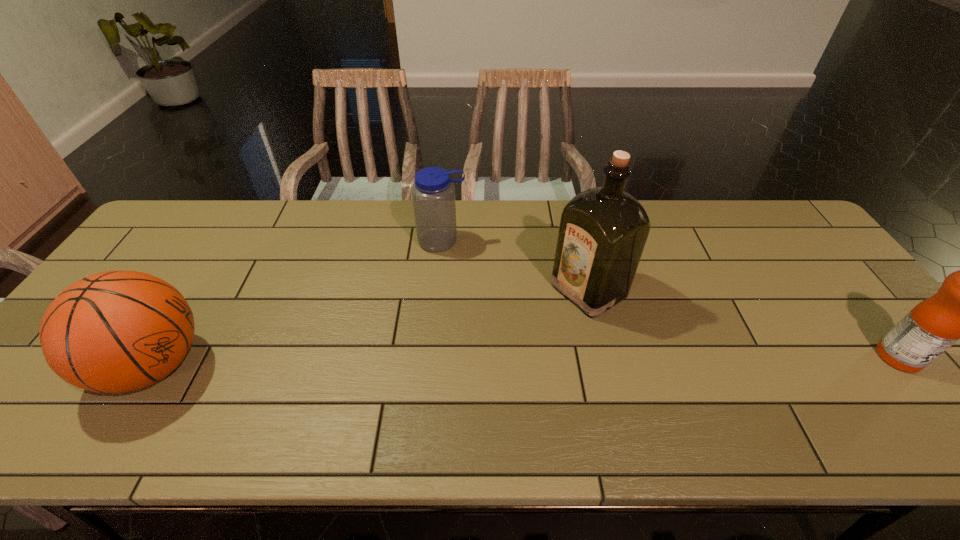
Find the location of a particular element. The image size is (960, 540). free space between the leftmost object and the rightmost object is located at coordinates (526, 361).

Find the location of a particular element. free space between the fruit juice and the basketball is located at coordinates (526, 361).

The width and height of the screenshot is (960, 540). I want to click on unoccupied area between the leftmost object and the fruit juice, so click(x=526, y=361).

You are a GUI agent. You are given a task and a screenshot of the screen. Output one action in this format:
    pyautogui.click(x=<x>, y=<y>)
    Task: Click on the unoccupied area between the tallest object and the basketball
    The width and height of the screenshot is (960, 540).
    Given the screenshot: What is the action you would take?
    [x=372, y=328]

At what (x,y) coordinates should I click in order to perform the action: click on free space between the tallest object and the basketball. Please return your answer as a coordinate pair (x, y). This screenshot has width=960, height=540. Looking at the image, I should click on (372, 328).

The image size is (960, 540). I want to click on object that is the third closest one to the third object from right to left, so click(x=959, y=310).

Identify which object is located as the second nearest to the rightmost object. Please provide its 2D coordinates. Your answer should be formatted as a tuple, i.e. [(x, y)], where the tuple contains the x and y coordinates of a point satisfying the conditions above.

[(433, 193)]

The image size is (960, 540). What are the coordinates of `blank space that satisfies the following two spatial constraints: 1. on the front side of the water bottle; 2. on the front label of the fruit juice` in the screenshot? It's located at (431, 357).

Where is `vacant point that satisfies the following two spatial constraints: 1. on the back side of the leftmost object; 2. on the left side of the farthest object`? The width and height of the screenshot is (960, 540). vacant point that satisfies the following two spatial constraints: 1. on the back side of the leftmost object; 2. on the left side of the farthest object is located at coordinates (230, 241).

Image resolution: width=960 pixels, height=540 pixels. What are the coordinates of `vacant area that satisfies the following two spatial constraints: 1. on the front side of the fruit juice; 2. on the front label of the third nearest object` in the screenshot? It's located at (604, 357).